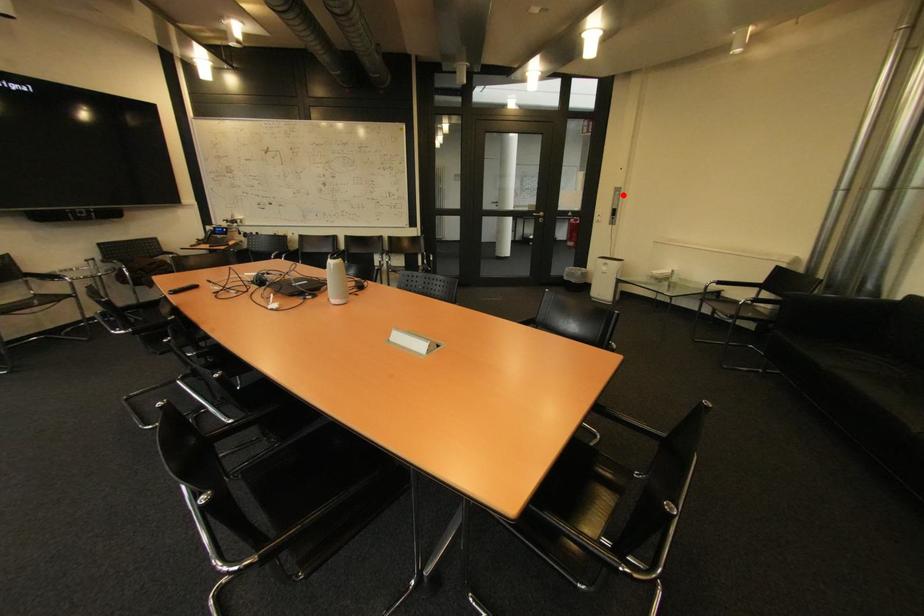
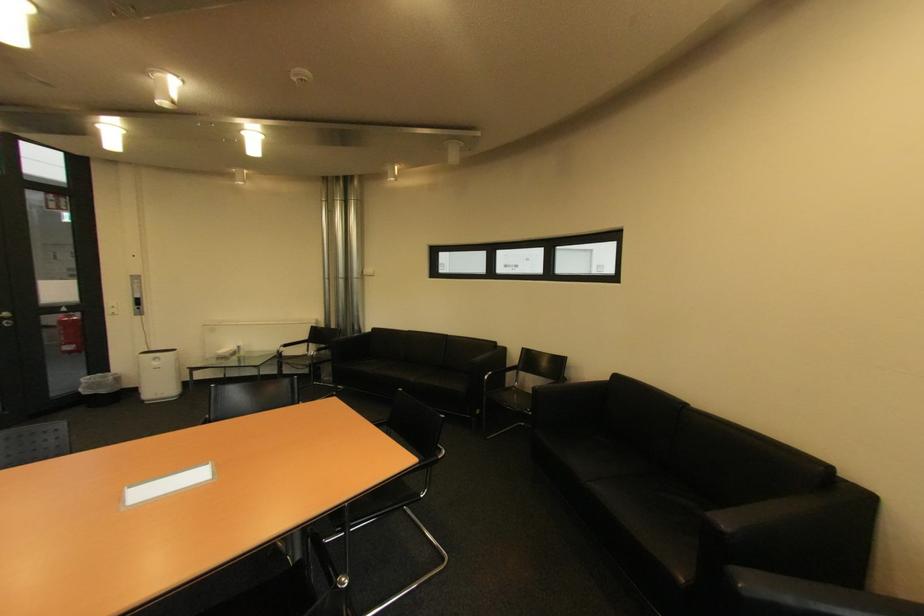
Question: I am providing you with two images of the same scene from different viewpoints. In image1, a red point is highlighted. Considering the same 3D point in image2, which of the following is correct?

Choices:
 (A) It is closer
 (B) It is farther

Answer: (B)